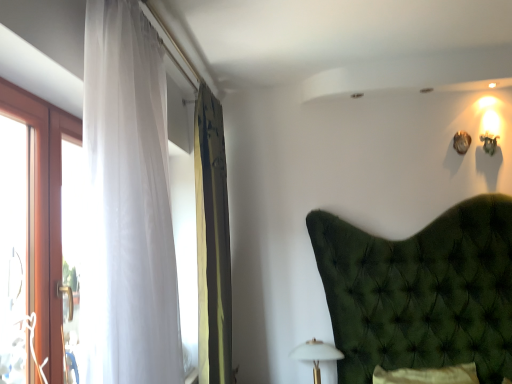
The image size is (512, 384). In order to click on white matte table lamp at lower center in this screenshot , I will do `click(316, 355)`.

Image resolution: width=512 pixels, height=384 pixels. Describe the element at coordinates (212, 243) in the screenshot. I see `green textured curtain at left, arranged as the first curtain when viewed from the back` at that location.

Where is `green textured curtain at left, the second curtain positioned from the front`? green textured curtain at left, the second curtain positioned from the front is located at coordinates (212, 243).

How much space does translucent white curtain at left, the first curtain when ordered from front to back, occupy vertically?

The height of translucent white curtain at left, the first curtain when ordered from front to back, is 4.63 feet.

This screenshot has width=512, height=384. Find the location of `white matte table lamp at lower center`. white matte table lamp at lower center is located at coordinates (316, 355).

Is white matte table lamp at lower center positioned before translucent white curtain at left, the first curtain when ordered from front to back?

No, the depth of white matte table lamp at lower center is greater than that of translucent white curtain at left, the first curtain when ordered from front to back.

From a real-world perspective, who is located higher, white matte table lamp at lower center or translucent white curtain at left, the 2th curtain from the back?

translucent white curtain at left, the 2th curtain from the back, from a real-world perspective.

Looking at this image, from the image's perspective, which is below, white matte table lamp at lower center or translucent white curtain at left, the first curtain when ordered from front to back?

From the image's view, white matte table lamp at lower center is below.

Is white matte table lamp at lower center taller than translucent white curtain at left, the first curtain when ordered from front to back?

In fact, white matte table lamp at lower center may be shorter than translucent white curtain at left, the first curtain when ordered from front to back.

Considering the sizes of objects translucent white curtain at left, the 2th curtain from the back, and green textured curtain at left, the second curtain positioned from the front, in the image provided, who is bigger, translucent white curtain at left, the 2th curtain from the back, or green textured curtain at left, the second curtain positioned from the front,?

translucent white curtain at left, the 2th curtain from the back, is bigger.

Between translucent white curtain at left, the 2th curtain from the back, and green textured curtain at left, the second curtain positioned from the front, which one appears on the left side from the viewer's perspective?

translucent white curtain at left, the 2th curtain from the back.

Are translucent white curtain at left, the first curtain when ordered from front to back, and green textured curtain at left, the second curtain positioned from the front, making contact?

No.

Considering the relative positions of translucent white curtain at left, the first curtain when ordered from front to back, and green textured curtain at left, the second curtain positioned from the front, in the image provided, is translucent white curtain at left, the first curtain when ordered from front to back, in front of green textured curtain at left, the second curtain positioned from the front,?

Yes, translucent white curtain at left, the first curtain when ordered from front to back, is closer to the camera.

Does point (306, 349) come closer to viewer compared to point (224, 202)?

No, (306, 349) is further to viewer.

From a real-world perspective, who is located higher, white matte table lamp at lower center or green textured curtain at left, the second curtain positioned from the front?

green textured curtain at left, the second curtain positioned from the front, from a real-world perspective.

You are a GUI agent. You are given a task and a screenshot of the screen. Output one action in this format:
    pyautogui.click(x=<x>, y=<y>)
    Task: Click on the 1st curtain directly above the white matte table lamp at lower center (from a real-world perspective)
    
    Given the screenshot: What is the action you would take?
    pos(212,243)

Is white matte table lamp at lower center located within translucent white curtain at left, the 2th curtain from the back?

No, white matte table lamp at lower center is not a part of translucent white curtain at left, the 2th curtain from the back.

Looking at this image, does translucent white curtain at left, the 2th curtain from the back, have a smaller size compared to white matte table lamp at lower center?

No, translucent white curtain at left, the 2th curtain from the back, is not smaller than white matte table lamp at lower center.

Is translucent white curtain at left, the 2th curtain from the back, closer to camera compared to white matte table lamp at lower center?

Yes, it is.

Would you say translucent white curtain at left, the 2th curtain from the back, is to the left or to the right of white matte table lamp at lower center in the picture?

In the image, translucent white curtain at left, the 2th curtain from the back, appears on the left side of white matte table lamp at lower center.

I want to click on curtain above the green textured curtain at left, the second curtain positioned from the front (from a real-world perspective), so click(x=127, y=204).

How much distance is there between green textured curtain at left, the second curtain positioned from the front, and translucent white curtain at left, the first curtain when ordered from front to back?

35.10 inches.

Is green textured curtain at left, the second curtain positioned from the front, positioned with its back to translucent white curtain at left, the 2th curtain from the back?

green textured curtain at left, the second curtain positioned from the front, does not have its back to translucent white curtain at left, the 2th curtain from the back.

Between point (221, 180) and point (120, 21), which one is positioned behind?

The point (221, 180) is behind.

Is white matte table lamp at lower center surrounded by green textured curtain at left, arranged as the first curtain when viewed from the back?

Definitely not — white matte table lamp at lower center is not inside green textured curtain at left, arranged as the first curtain when viewed from the back.

Could you measure the distance between green textured curtain at left, arranged as the first curtain when viewed from the back, and white matte table lamp at lower center?

green textured curtain at left, arranged as the first curtain when viewed from the back, and white matte table lamp at lower center are 30.18 inches apart.

From the picture: Considering the relative positions of green textured curtain at left, arranged as the first curtain when viewed from the back, and white matte table lamp at lower center in the image provided, is green textured curtain at left, arranged as the first curtain when viewed from the back, to the left or to the right of white matte table lamp at lower center?

Based on their positions, green textured curtain at left, arranged as the first curtain when viewed from the back, is located to the left of white matte table lamp at lower center.

From a real-world perspective, does green textured curtain at left, arranged as the first curtain when viewed from the back, sit lower than white matte table lamp at lower center?

Incorrect, from a real-world perspective, green textured curtain at left, arranged as the first curtain when viewed from the back, is higher than white matte table lamp at lower center.

Locate an element on the screen. table lamp directly beneath the translucent white curtain at left, the 2th curtain from the back (from a real-world perspective) is located at coordinates (316, 355).

Where is `curtain that is above the green textured curtain at left, the second curtain positioned from the front (from the image's perspective)`? The width and height of the screenshot is (512, 384). curtain that is above the green textured curtain at left, the second curtain positioned from the front (from the image's perspective) is located at coordinates (127, 204).

Looking at the image, which one is located closer to green textured curtain at left, the second curtain positioned from the front, translucent white curtain at left, the 2th curtain from the back, or white matte table lamp at lower center?

white matte table lamp at lower center is positioned closer to the anchor green textured curtain at left, the second curtain positioned from the front.

Estimate the real-world distances between objects in this image. Which object is further from green textured curtain at left, arranged as the first curtain when viewed from the back, white matte table lamp at lower center or translucent white curtain at left, the first curtain when ordered from front to back?

Based on the image, translucent white curtain at left, the first curtain when ordered from front to back, appears to be further to green textured curtain at left, arranged as the first curtain when viewed from the back.

From the image, which object appears to be farther from white matte table lamp at lower center, green textured curtain at left, the second curtain positioned from the front, or translucent white curtain at left, the 2th curtain from the back?

The object further to white matte table lamp at lower center is translucent white curtain at left, the 2th curtain from the back.

When comparing their distances from white matte table lamp at lower center, does translucent white curtain at left, the 2th curtain from the back, or green textured curtain at left, the second curtain positioned from the front, seem closer?

green textured curtain at left, the second curtain positioned from the front, is closer to white matte table lamp at lower center.

Looking at the image, which one is located further to translucent white curtain at left, the 2th curtain from the back, white matte table lamp at lower center or green textured curtain at left, arranged as the first curtain when viewed from the back?

Among the two, white matte table lamp at lower center is located further to translucent white curtain at left, the 2th curtain from the back.

Based on their spatial positions, is green textured curtain at left, the second curtain positioned from the front, or white matte table lamp at lower center closer to translucent white curtain at left, the first curtain when ordered from front to back?

Based on the image, green textured curtain at left, the second curtain positioned from the front, appears to be nearer to translucent white curtain at left, the first curtain when ordered from front to back.

The width and height of the screenshot is (512, 384). Identify the location of curtain between translucent white curtain at left, the first curtain when ordered from front to back, and white matte table lamp at lower center from front to back. (212, 243).